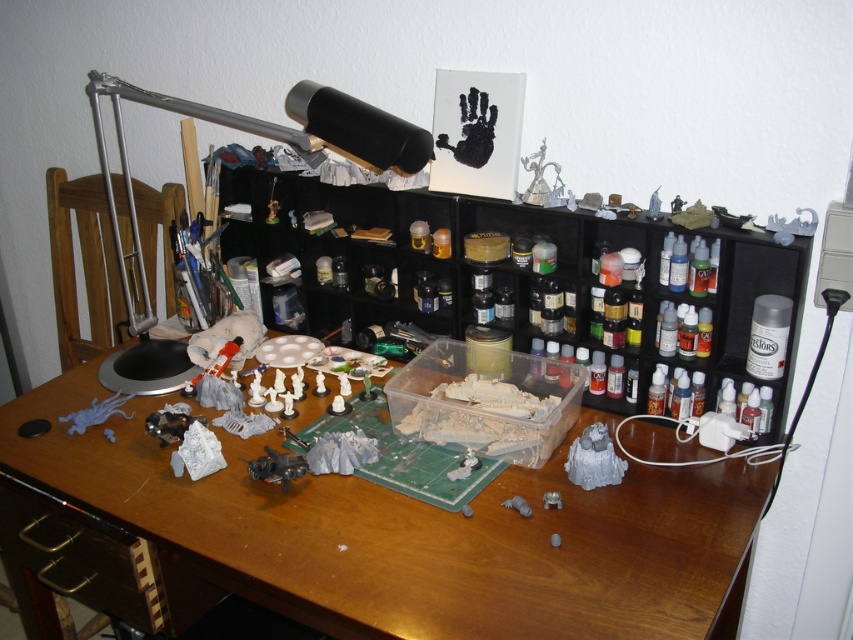
Which is above, wooden at center or wooden drawer at lower left?

wooden at center is higher up.

Is point (596, 589) less distant than point (49, 609)?

Yes.

Locate an element on the screen. Image resolution: width=853 pixels, height=640 pixels. wooden at center is located at coordinates (408, 536).

How distant is black plastic shelf at center from wooden drawer at lower left?

black plastic shelf at center is 31.03 inches away from wooden drawer at lower left.

Who is taller, black plastic shelf at center or wooden drawer at lower left?

With more height is black plastic shelf at center.

Find the location of a particular element. The width and height of the screenshot is (853, 640). black plastic shelf at center is located at coordinates (511, 230).

Who is more forward, (801, 288) or (129, 186)?

Point (801, 288) is in front.

Is black plastic shelf at center positioned behind silver metallic desk lamp at upper left?

That is True.

Find the location of a particular element. The width and height of the screenshot is (853, 640). black plastic shelf at center is located at coordinates (511, 230).

The height and width of the screenshot is (640, 853). Find the location of `black plastic shelf at center`. black plastic shelf at center is located at coordinates (511, 230).